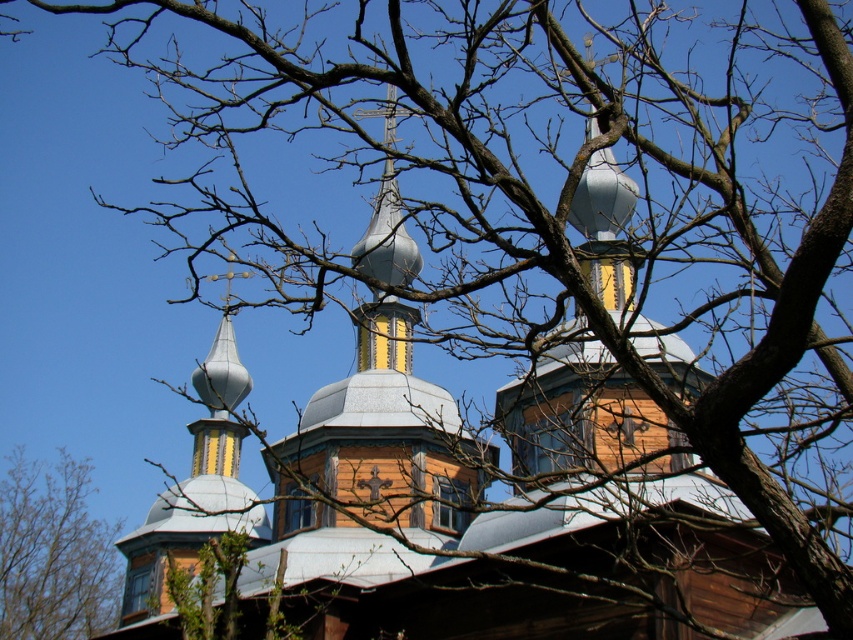
Is point (457, 497) less distant than point (45, 618)?

Yes, point (457, 497) is closer to viewer.

Is point (299, 433) more distant than point (9, 506)?

No.

What are the coordinates of `metallic silver dome at center` in the screenshot? It's located at (379, 442).